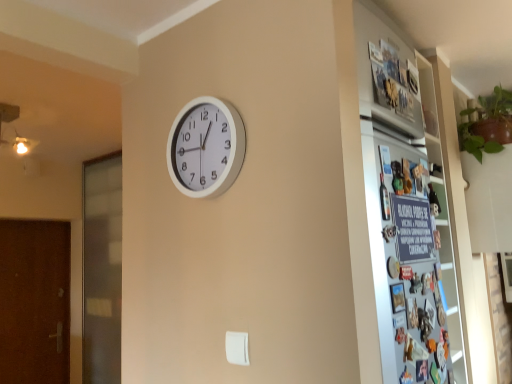
In order to click on brown textured door at left, the 2th screen door in the right-to-left sequence in this screenshot , I will do `click(34, 301)`.

What is the approximate width of white plastic wall clock at center?

white plastic wall clock at center is 2.24 inches wide.

Find the location of a particular element. metallic silver fridge at right is located at coordinates (407, 207).

Can you tell me how much white plastic wall clock at center and metallic silver fridge at right differ in facing direction?

92 degrees separate the facing orientations of white plastic wall clock at center and metallic silver fridge at right.

In terms of size, does white plastic wall clock at center appear bigger or smaller than metallic silver fridge at right?

Clearly, white plastic wall clock at center is smaller in size than metallic silver fridge at right.

From a real-world perspective, which is physically below, white plastic wall clock at center or metallic silver fridge at right?

metallic silver fridge at right, from a real-world perspective.

In terms of height, does white plastic wall clock at center look taller or shorter compared to metallic silver fridge at right?

Clearly, white plastic wall clock at center is shorter compared to metallic silver fridge at right.

Could transparent glass screen door at left, which is the 2th screen door in left-to-right order, be considered to be inside metallic silver fridge at right?

No, transparent glass screen door at left, which is the 2th screen door in left-to-right order, is not a part of metallic silver fridge at right.

Would you say metallic silver fridge at right is a long distance from transparent glass screen door at left, positioned as the 1th screen door in right-to-left order?

Yes, metallic silver fridge at right is far from transparent glass screen door at left, positioned as the 1th screen door in right-to-left order.

Between metallic silver fridge at right and transparent glass screen door at left, which is the 2th screen door in left-to-right order, which one is positioned behind?

transparent glass screen door at left, which is the 2th screen door in left-to-right order.

Is metallic silver fridge at right oriented away from transparent glass screen door at left, positioned as the 1th screen door in right-to-left order?

Yes, metallic silver fridge at right's orientation is away from transparent glass screen door at left, positioned as the 1th screen door in right-to-left order.

Is metallic silver fridge at right at the back of transparent glass screen door at left, which is the 2th screen door in left-to-right order?

No.

Is the surface of transparent glass screen door at left, which is the 2th screen door in left-to-right order, in direct contact with metallic silver fridge at right?

transparent glass screen door at left, which is the 2th screen door in left-to-right order, is not next to metallic silver fridge at right, and they're not touching.

Based on the photo, considering their positions, is transparent glass screen door at left, positioned as the 1th screen door in right-to-left order, located in front of or behind metallic silver fridge at right?

Visually, transparent glass screen door at left, positioned as the 1th screen door in right-to-left order, is located behind metallic silver fridge at right.

Does transparent glass screen door at left, which is the 2th screen door in left-to-right order, have a greater width compared to metallic silver fridge at right?

Yes, transparent glass screen door at left, which is the 2th screen door in left-to-right order, is wider than metallic silver fridge at right.

Does point (103, 213) come in front of point (206, 170)?

No, (103, 213) is behind (206, 170).

From the image's perspective, is transparent glass screen door at left, which is the 2th screen door in left-to-right order, located beneath white plastic wall clock at center?

Yes.

Does transparent glass screen door at left, which is the 2th screen door in left-to-right order, appear on the right side of white plastic wall clock at center?

In fact, transparent glass screen door at left, which is the 2th screen door in left-to-right order, is to the left of white plastic wall clock at center.

Is transparent glass screen door at left, positioned as the 1th screen door in right-to-left order, aimed at white plastic wall clock at center?

No, transparent glass screen door at left, positioned as the 1th screen door in right-to-left order, does not turn towards white plastic wall clock at center.

Which screen door is the 2nd one when counting from the left side of the metallic silver fridge at right? Please provide its 2D coordinates.

[(34, 301)]

How different are the orientations of metallic silver fridge at right and brown textured door at left, the 1th screen door when ordered from left to right, in degrees?

0.716 degrees separate the facing orientations of metallic silver fridge at right and brown textured door at left, the 1th screen door when ordered from left to right.

Is metallic silver fridge at right located outside brown textured door at left, the 1th screen door when ordered from left to right?

Absolutely, metallic silver fridge at right is external to brown textured door at left, the 1th screen door when ordered from left to right.

From a real-world perspective, is metallic silver fridge at right physically above brown textured door at left, the 2th screen door in the right-to-left sequence?

Yes, from a real-world perspective, metallic silver fridge at right is on top of brown textured door at left, the 2th screen door in the right-to-left sequence.

Does white plastic wall clock at center appear on the left side of transparent glass screen door at left, which is the 2th screen door in left-to-right order?

Incorrect, white plastic wall clock at center is not on the left side of transparent glass screen door at left, which is the 2th screen door in left-to-right order.

Considering the relative sizes of white plastic wall clock at center and transparent glass screen door at left, positioned as the 1th screen door in right-to-left order, in the image provided, is white plastic wall clock at center thinner than transparent glass screen door at left, positioned as the 1th screen door in right-to-left order,?

Correct, the width of white plastic wall clock at center is less than that of transparent glass screen door at left, positioned as the 1th screen door in right-to-left order.

From a real-world perspective, does white plastic wall clock at center sit lower than transparent glass screen door at left, positioned as the 1th screen door in right-to-left order?

No, from a real-world perspective, white plastic wall clock at center is not beneath transparent glass screen door at left, positioned as the 1th screen door in right-to-left order.

Is white plastic wall clock at center completely or partially outside of transparent glass screen door at left, which is the 2th screen door in left-to-right order?

Yes.

This screenshot has width=512, height=384. I want to click on screen door that is under the transparent glass screen door at left, positioned as the 1th screen door in right-to-left order (from a real-world perspective), so click(34, 301).

From the image's perspective, is brown textured door at left, the 2th screen door in the right-to-left sequence, under transparent glass screen door at left, positioned as the 1th screen door in right-to-left order?

Correct, brown textured door at left, the 2th screen door in the right-to-left sequence, appears lower than transparent glass screen door at left, positioned as the 1th screen door in right-to-left order, in the image.

Which of these two, brown textured door at left, the 2th screen door in the right-to-left sequence, or transparent glass screen door at left, which is the 2th screen door in left-to-right order, stands shorter?

With less height is brown textured door at left, the 2th screen door in the right-to-left sequence.

What's the angular difference between brown textured door at left, the 2th screen door in the right-to-left sequence, and transparent glass screen door at left, which is the 2th screen door in left-to-right order,'s facing directions?

The angle between the facing direction of brown textured door at left, the 2th screen door in the right-to-left sequence, and the facing direction of transparent glass screen door at left, which is the 2th screen door in left-to-right order, is 90.1 degrees.

I want to click on wall clock behind the metallic silver fridge at right, so click(x=206, y=147).

You are a GUI agent. You are given a task and a screenshot of the screen. Output one action in this format:
    pyautogui.click(x=<x>, y=<y>)
    Task: Click on the fridge located above the transparent glass screen door at left, positioned as the 1th screen door in right-to-left order (from a real-world perspective)
    Image resolution: width=512 pixels, height=384 pixels.
    Given the screenshot: What is the action you would take?
    pos(407,207)

Which object lies nearer to the anchor point white plastic wall clock at center, brown textured door at left, the 2th screen door in the right-to-left sequence, or metallic silver fridge at right?

metallic silver fridge at right.

Looking at the image, which one is located closer to transparent glass screen door at left, positioned as the 1th screen door in right-to-left order, white plastic wall clock at center or brown textured door at left, the 2th screen door in the right-to-left sequence?

brown textured door at left, the 2th screen door in the right-to-left sequence.

Estimate the real-world distances between objects in this image. Which object is further from white plastic wall clock at center, transparent glass screen door at left, positioned as the 1th screen door in right-to-left order, or brown textured door at left, the 1th screen door when ordered from left to right?

The object further to white plastic wall clock at center is brown textured door at left, the 1th screen door when ordered from left to right.

Considering their positions, is metallic silver fridge at right positioned further to white plastic wall clock at center than brown textured door at left, the 2th screen door in the right-to-left sequence?

The object further to white plastic wall clock at center is brown textured door at left, the 2th screen door in the right-to-left sequence.

From the image, which object appears to be farther from brown textured door at left, the 1th screen door when ordered from left to right, transparent glass screen door at left, which is the 2th screen door in left-to-right order, or metallic silver fridge at right?

Among the two, metallic silver fridge at right is located further to brown textured door at left, the 1th screen door when ordered from left to right.

Considering their positions, is metallic silver fridge at right positioned further to transparent glass screen door at left, which is the 2th screen door in left-to-right order, than white plastic wall clock at center?

metallic silver fridge at right is further to transparent glass screen door at left, which is the 2th screen door in left-to-right order.

Based on their spatial positions, is metallic silver fridge at right or brown textured door at left, the 2th screen door in the right-to-left sequence, further from transparent glass screen door at left, positioned as the 1th screen door in right-to-left order?

The object further to transparent glass screen door at left, positioned as the 1th screen door in right-to-left order, is metallic silver fridge at right.

Which object lies nearer to the anchor point metallic silver fridge at right, brown textured door at left, the 2th screen door in the right-to-left sequence, or transparent glass screen door at left, positioned as the 1th screen door in right-to-left order?

transparent glass screen door at left, positioned as the 1th screen door in right-to-left order.

Where is `screen door between brown textured door at left, the 1th screen door when ordered from left to right, and metallic silver fridge at right, in the horizontal direction`? screen door between brown textured door at left, the 1th screen door when ordered from left to right, and metallic silver fridge at right, in the horizontal direction is located at coordinates (102, 269).

Locate an element on the screen. This screenshot has width=512, height=384. wall clock located between brown textured door at left, the 2th screen door in the right-to-left sequence, and metallic silver fridge at right in the left-right direction is located at coordinates (206, 147).

The height and width of the screenshot is (384, 512). Find the location of `wall clock between metallic silver fridge at right and transparent glass screen door at left, positioned as the 1th screen door in right-to-left order, from front to back`. wall clock between metallic silver fridge at right and transparent glass screen door at left, positioned as the 1th screen door in right-to-left order, from front to back is located at coordinates (206, 147).

This screenshot has width=512, height=384. I want to click on screen door between white plastic wall clock at center and brown textured door at left, the 2th screen door in the right-to-left sequence, along the z-axis, so 102,269.